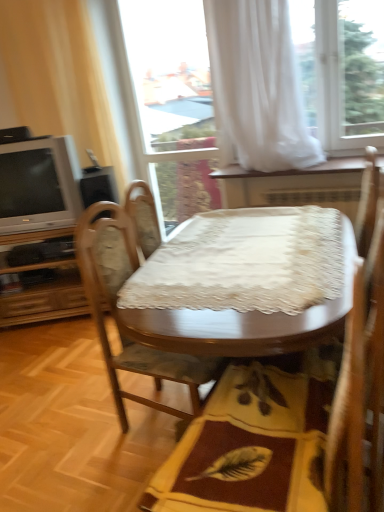
Question: Does matte silver television at left turn towards transparent glass door at upper center?

Choices:
 (A) no
 (B) yes

Answer: (A)

Question: Is matte silver television at left positioned behind transparent glass door at upper center?

Choices:
 (A) yes
 (B) no

Answer: (B)

Question: Is matte silver television at left at the right side of transparent glass door at upper center?

Choices:
 (A) no
 (B) yes

Answer: (A)

Question: Is matte silver television at left smaller than transparent glass door at upper center?

Choices:
 (A) no
 (B) yes

Answer: (A)

Question: Is matte silver television at left positioned before transparent glass door at upper center?

Choices:
 (A) no
 (B) yes

Answer: (B)

Question: Does matte silver television at left have a lesser height compared to transparent glass door at upper center?

Choices:
 (A) yes
 (B) no

Answer: (A)

Question: From the image's perspective, is yellow fabric mat at center below wooden chair at center?

Choices:
 (A) yes
 (B) no

Answer: (A)

Question: Does yellow fabric mat at center have a greater width compared to wooden chair at center?

Choices:
 (A) yes
 (B) no

Answer: (A)

Question: Can we say yellow fabric mat at center lies outside wooden chair at center?

Choices:
 (A) no
 (B) yes

Answer: (B)

Question: From a real-world perspective, is yellow fabric mat at center under wooden chair at center?

Choices:
 (A) yes
 (B) no

Answer: (A)

Question: Does yellow fabric mat at center contain wooden chair at center?

Choices:
 (A) yes
 (B) no

Answer: (B)

Question: Considering the relative positions of yellow fabric mat at center and wooden chair at center in the image provided, is yellow fabric mat at center to the right of wooden chair at center from the viewer's perspective?

Choices:
 (A) yes
 (B) no

Answer: (A)

Question: From a real-world perspective, is wooden chair at center beneath beige fabric curtain at left, which is counted as the 1th curtain, starting from the left?

Choices:
 (A) no
 (B) yes

Answer: (B)